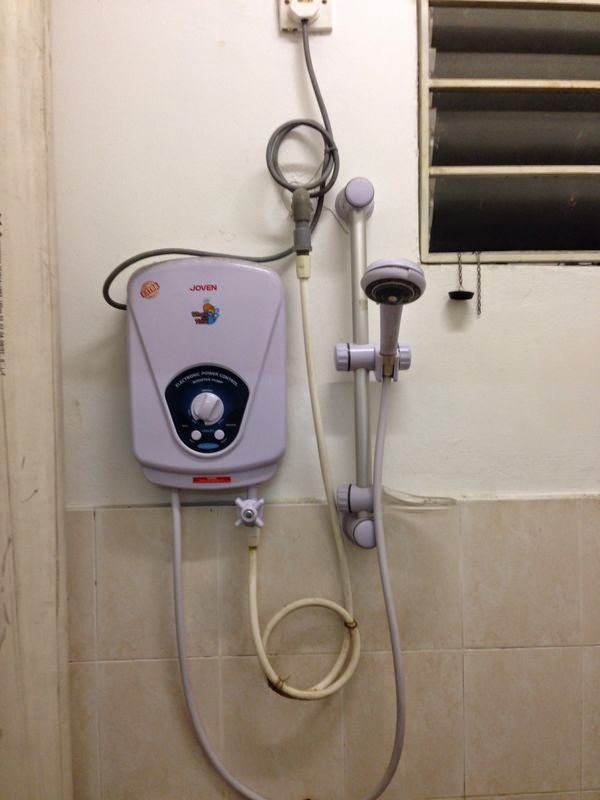
Find the location of a particular element. The width and height of the screenshot is (600, 800). black window is located at coordinates (522, 136).